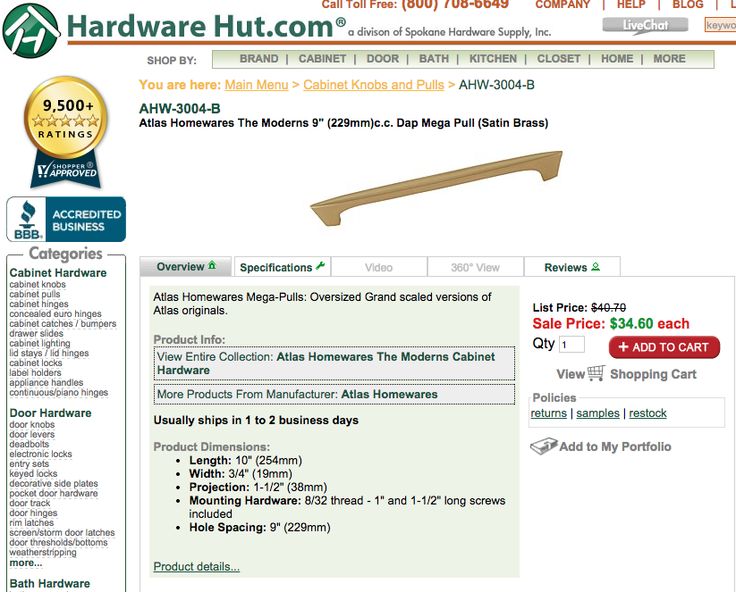
Locate an element on the screen. This screenshot has height=592, width=736. door tab is located at coordinates (378, 60).